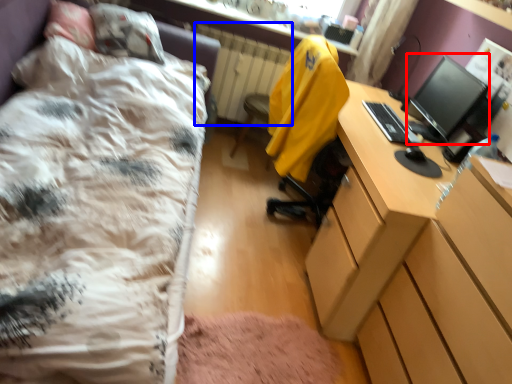
Question: Which object appears closest to the camera in this image, computer monitor (highlighted by a red box) or radiator (highlighted by a blue box)?

Choices:
 (A) computer monitor
 (B) radiator

Answer: (A)